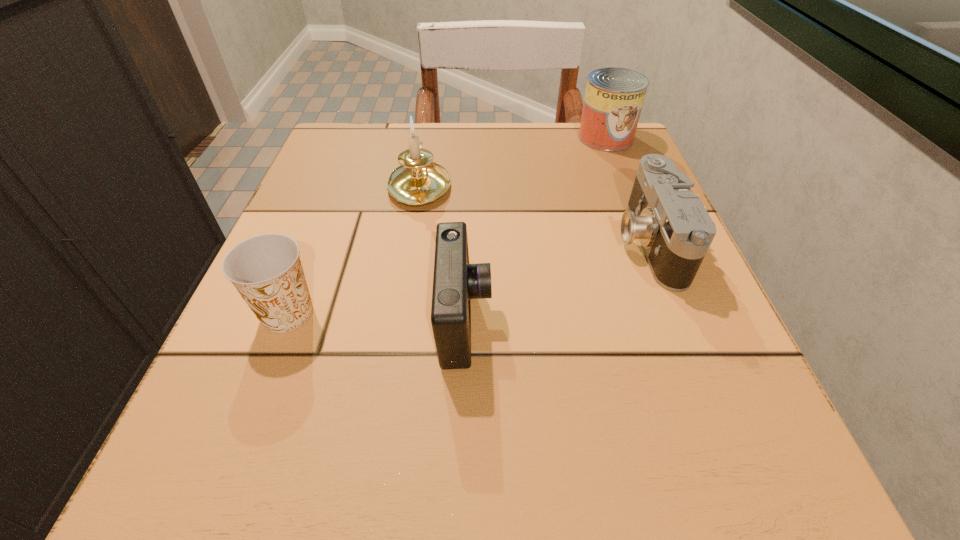
Identify the location of free space located 0.140m on the lens of the right camera. The image size is (960, 540). (534, 241).

Identify the location of free region located on the lens of the right camera. This screenshot has width=960, height=540. (406, 241).

Where is `vacant space situated 0.340m on the lens of the right camera`? Image resolution: width=960 pixels, height=540 pixels. vacant space situated 0.340m on the lens of the right camera is located at coordinates (413, 241).

Identify the location of candle holder located at the far edge. (419, 181).

Image resolution: width=960 pixels, height=540 pixels. Find the location of `can positioned at the far edge`. can positioned at the far edge is located at coordinates (614, 97).

The image size is (960, 540). In order to click on candle holder positioned at the left edge in this screenshot , I will do `click(419, 181)`.

You are a GUI agent. You are given a task and a screenshot of the screen. Output one action in this format:
    pyautogui.click(x=<x>, y=<y>)
    Task: Click on the Dixie cup that is at the left edge
    This screenshot has width=960, height=540.
    Given the screenshot: What is the action you would take?
    pyautogui.click(x=266, y=270)

I want to click on can that is at the right edge, so click(x=614, y=97).

The height and width of the screenshot is (540, 960). Find the location of `camera that is positioned at the right edge`. camera that is positioned at the right edge is located at coordinates (675, 230).

Image resolution: width=960 pixels, height=540 pixels. What are the coordinates of `object positioned at the far left corner` in the screenshot? It's located at (419, 181).